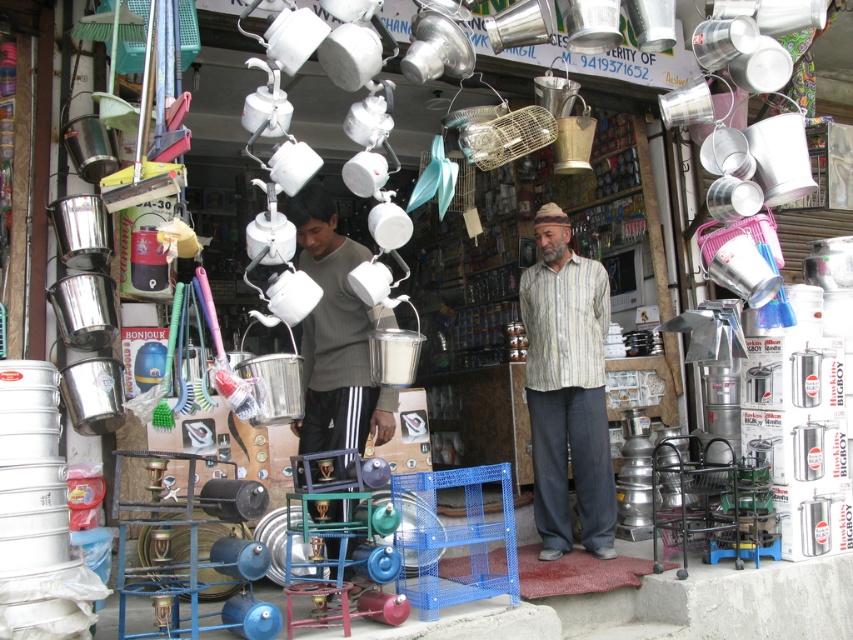
You are a customer at the market stall and want to choose between the striped cotton shirt at center and the gray sweater at center. Which item is narrower?

The striped cotton shirt at center has a lesser width compared to the gray sweater at center, so it is narrower.

You are a customer at the market stall and want to buy both the striped cotton shirt at center and the gray sweater at center. Since you have a small bag, you need to know which one takes up more space. Which item should you consider packing first?

The striped cotton shirt at center occupies less space than the gray sweater at center, so you should pack the gray sweater at center first to accommodate its larger size.